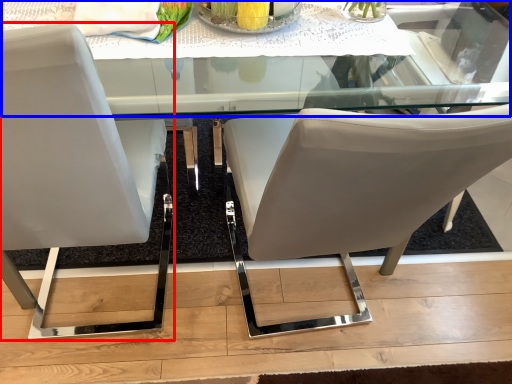
Question: Which point is closer to the camera, chair (highlighted by a red box) or round table (highlighted by a blue box)?

Choices:
 (A) chair
 (B) round table

Answer: (A)